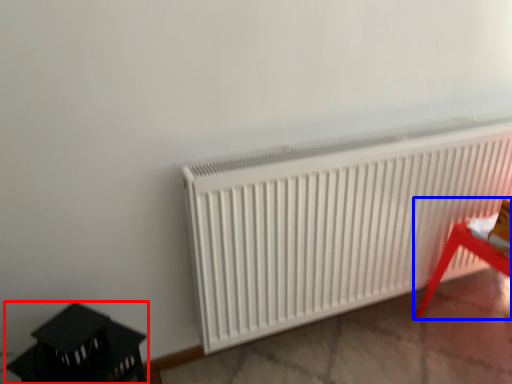
Question: Which object appears closest to the camera in this image, furniture (highlighted by a red box) or furniture (highlighted by a blue box)?

Choices:
 (A) furniture
 (B) furniture

Answer: (A)